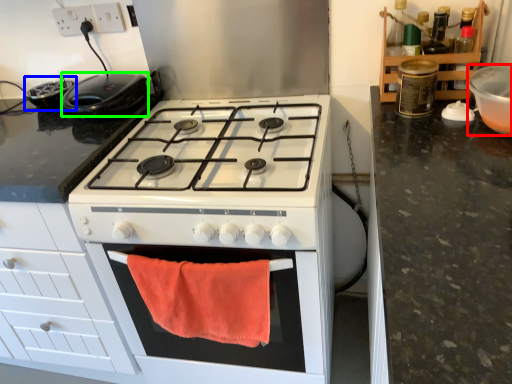
Question: Which object is the farthest from appliance (highlighted by a red box)? Choose among these: appliance (highlighted by a blue box) or kitchen appliance (highlighted by a green box).

Choices:
 (A) appliance
 (B) kitchen appliance

Answer: (A)